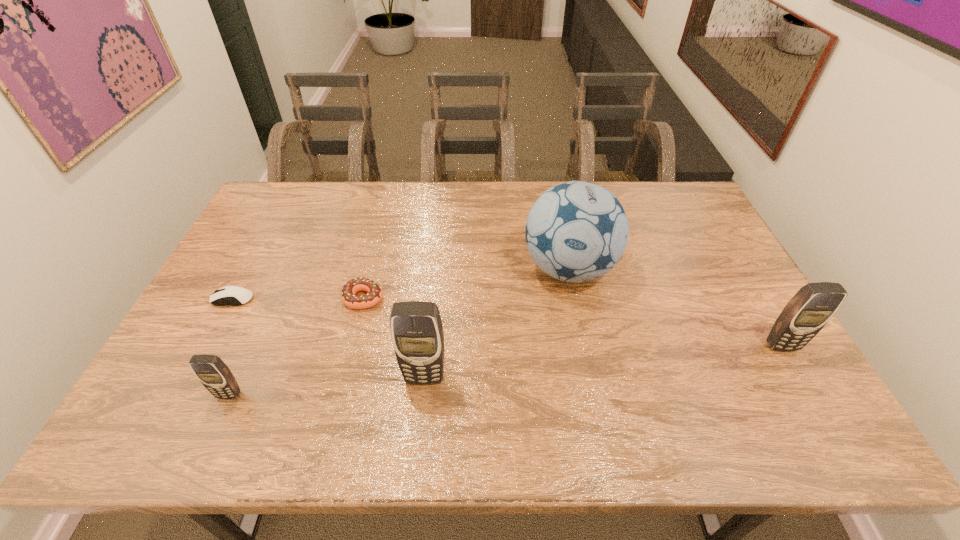
The height and width of the screenshot is (540, 960). In order to click on the second object from left to right in this screenshot , I will do pos(212,372).

You are a GUI agent. You are given a task and a screenshot of the screen. Output one action in this format:
    pyautogui.click(x=<x>, y=<y>)
    Task: Click on the leftmost cellular telephone
    Image resolution: width=960 pixels, height=540 pixels.
    Given the screenshot: What is the action you would take?
    pyautogui.click(x=212, y=372)

This screenshot has height=540, width=960. What are the coordinates of `the fourth object from left to right` in the screenshot? It's located at (417, 334).

This screenshot has height=540, width=960. What are the coordinates of `the fifth farthest object` in the screenshot? It's located at (417, 334).

Locate an element on the screen. The width and height of the screenshot is (960, 540). the rightmost object is located at coordinates (810, 309).

Find the location of a particular element. The width and height of the screenshot is (960, 540). the second tallest cellular telephone is located at coordinates (810, 309).

This screenshot has height=540, width=960. Identify the location of mouse. (241, 296).

At what (x,y) coordinates should I click in order to perform the action: click on the shortest object. Please return your answer as a coordinate pair (x, y). Looking at the image, I should click on (241, 296).

Identify the location of the fifth object from left to right. This screenshot has height=540, width=960. (576, 231).

Find the location of a particular element. Image resolution: width=960 pixels, height=540 pixels. doughnut is located at coordinates [350, 288].